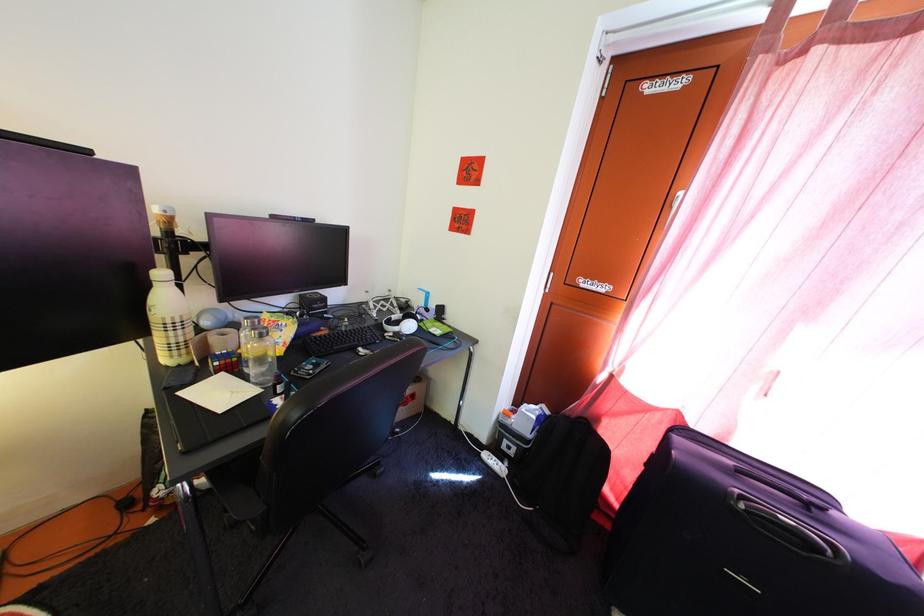
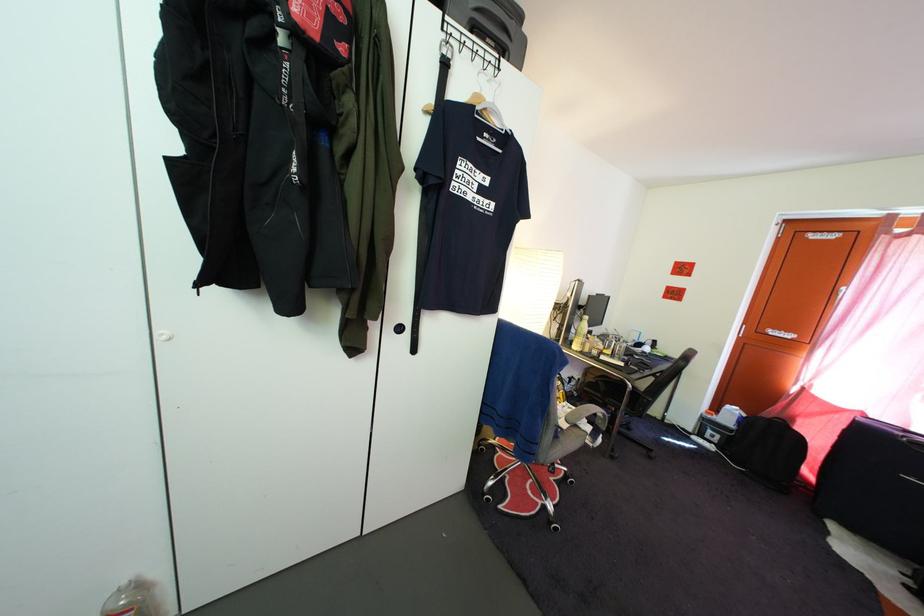
Which direction would the cameraman need to move to produce the second image?

The cameraman walked toward left, backward.